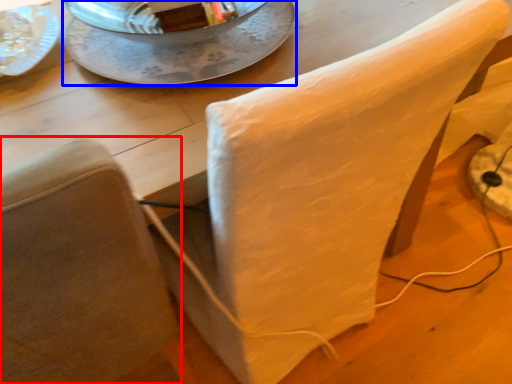
Question: Which object is further to the camera taking this photo, chair (highlighted by a red box) or glass plate (highlighted by a blue box)?

Choices:
 (A) chair
 (B) glass plate

Answer: (B)